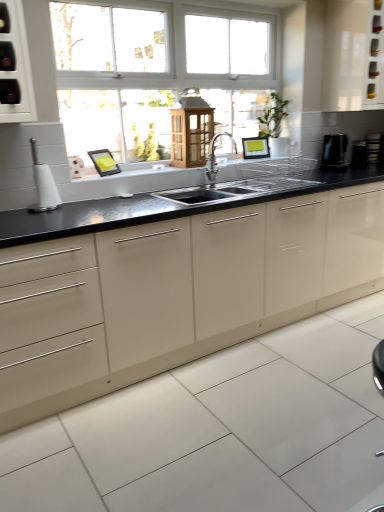
Question: Is there a large distance between black granite countertop at center and wooden lantern at center, which appears as the second cabinetry when viewed from the right?

Choices:
 (A) yes
 (B) no

Answer: (B)

Question: Is black granite countertop at center at the left side of wooden lantern at center, arranged as the 1th cabinetry when ordered from the bottom?

Choices:
 (A) yes
 (B) no

Answer: (B)

Question: Considering the relative sizes of black granite countertop at center and wooden lantern at center, which appears as the second cabinetry when viewed from the right, in the image provided, is black granite countertop at center bigger than wooden lantern at center, which appears as the second cabinetry when viewed from the right,?

Choices:
 (A) no
 (B) yes

Answer: (B)

Question: Is black granite countertop at center touching wooden lantern at center, placed as the 1th cabinetry when sorted from left to right?

Choices:
 (A) yes
 (B) no

Answer: (B)

Question: Does black granite countertop at center appear on the right side of wooden lantern at center, the 2th cabinetry when ordered from top to bottom?

Choices:
 (A) no
 (B) yes

Answer: (B)

Question: Is white glossy toilet brush at left, which is the 1th appliance from front to back, bigger or smaller than white glossy cabinet at upper right, arranged as the 2th cabinetry when viewed from the left?

Choices:
 (A) big
 (B) small

Answer: (B)

Question: Considering their positions, is white glossy toilet brush at left, the 1th appliance positioned from the left, located in front of or behind white glossy cabinet at upper right, acting as the 1th cabinetry starting from the right?

Choices:
 (A) behind
 (B) front

Answer: (B)

Question: Does point (41, 194) appear closer or farther from the camera than point (339, 49)?

Choices:
 (A) closer
 (B) farther

Answer: (A)

Question: From their relative heights in the image, would you say white glossy toilet brush at left, which is the 1th appliance from front to back, is taller or shorter than white glossy cabinet at upper right, the first cabinetry in the top-to-bottom sequence?

Choices:
 (A) tall
 (B) short

Answer: (B)

Question: From the image's perspective, is black plastic toaster at right, the 1th appliance when ordered from right to left, located above or below silver metallic faucet at center?

Choices:
 (A) above
 (B) below

Answer: (A)

Question: Considering their positions, is black plastic toaster at right, arranged as the fourth appliance when viewed from the left, located in front of or behind silver metallic faucet at center?

Choices:
 (A) front
 (B) behind

Answer: (B)

Question: From a real-world perspective, is black plastic toaster at right, arranged as the fourth appliance when viewed from the left, physically located above or below silver metallic faucet at center?

Choices:
 (A) below
 (B) above

Answer: (A)

Question: In terms of size, does black plastic toaster at right, the 1th appliance when ordered from right to left, appear bigger or smaller than silver metallic faucet at center?

Choices:
 (A) big
 (B) small

Answer: (B)

Question: From the image's perspective, is white glossy cabinet at upper right, acting as the 1th cabinetry starting from the right, above or below silver metallic faucet at center?

Choices:
 (A) above
 (B) below

Answer: (A)

Question: Looking at their shapes, would you say white glossy cabinet at upper right, the first cabinetry in the top-to-bottom sequence, is wider or thinner than silver metallic faucet at center?

Choices:
 (A) thin
 (B) wide

Answer: (B)